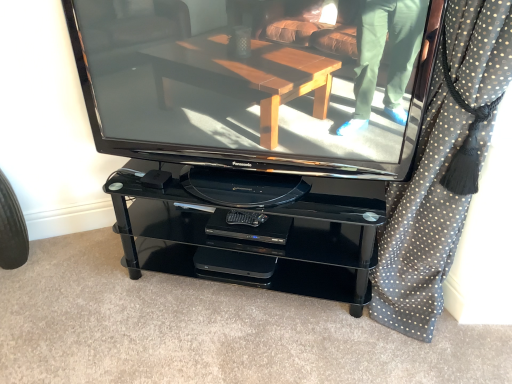
The width and height of the screenshot is (512, 384). What do you see at coordinates (12, 228) in the screenshot?
I see `black rubber tire at lower left` at bounding box center [12, 228].

Locate an element on the screen. Image resolution: width=512 pixels, height=384 pixels. matte black television at center is located at coordinates (245, 93).

From the image's perspective, is matte black television at center beneath black dotted fabric at right?

No, from the image's perspective, matte black television at center is not beneath black dotted fabric at right.

Between matte black television at center and black dotted fabric at right, which one appears on the right side from the viewer's perspective?

black dotted fabric at right.

Is there a large distance between matte black television at center and black dotted fabric at right?

No.

Does matte black television at center turn towards black dotted fabric at right?

No, matte black television at center is not aimed at black dotted fabric at right.

Is black rubber tire at lower left taller or shorter than matte black television at center?

black rubber tire at lower left is shorter than matte black television at center.

Is point (1, 216) positioned in front of point (383, 110)?

No, (1, 216) is further to viewer.

From the image's perspective, is black rubber tire at lower left over matte black television at center?

Incorrect, from the image's perspective, black rubber tire at lower left is lower than matte black television at center.

From a real-world perspective, is black rubber tire at lower left above or below matte black television at center?

black rubber tire at lower left is situated lower than matte black television at center in the real world.

Is black dotted fabric at right further to the viewer compared to black rubber tire at lower left?

No, it is not.

Consider the image. From a real-world perspective, is black dotted fabric at right positioned over black rubber tire at lower left based on gravity?

Yes.

Image resolution: width=512 pixels, height=384 pixels. Identify the location of tire located below the black dotted fabric at right (from the image's perspective). (12, 228).

Where is `television lying on the right of black rubber tire at lower left`? The width and height of the screenshot is (512, 384). television lying on the right of black rubber tire at lower left is located at coordinates (245, 93).

From a real-world perspective, between matte black television at center and black rubber tire at lower left, who is vertically lower?

black rubber tire at lower left, from a real-world perspective.

Does matte black television at center turn towards black rubber tire at lower left?

No, matte black television at center does not turn towards black rubber tire at lower left.

How far apart are matte black television at center and black rubber tire at lower left?

matte black television at center and black rubber tire at lower left are 1.01 meters apart.

Is black dotted fabric at right facing away from matte black television at center?

No, black dotted fabric at right is not facing away from matte black television at center.

Considering the relative sizes of black dotted fabric at right and matte black television at center in the image provided, is black dotted fabric at right shorter than matte black television at center?

No.

Which object is closer to the camera taking this photo, black dotted fabric at right or matte black television at center?

black dotted fabric at right is closer to the camera.

Is point (433, 303) positioned behind point (196, 109)?

Yes.

How different are the orientations of black rubber tire at lower left and black dotted fabric at right in degrees?

11 degrees separate the facing orientations of black rubber tire at lower left and black dotted fabric at right.

How distant is black rubber tire at lower left from black dotted fabric at right?

They are 5.41 feet apart.

From a real-world perspective, who is located higher, black rubber tire at lower left or black dotted fabric at right?

black dotted fabric at right.

Is black rubber tire at lower left shorter than black dotted fabric at right?

Yes, black rubber tire at lower left is shorter than black dotted fabric at right.

This screenshot has height=384, width=512. Identify the location of curtain on the right of matte black television at center. (422, 224).

At what (x,y) coordinates should I click in order to perform the action: click on tire lying below the matte black television at center (from the image's perspective). Please return your answer as a coordinate pair (x, y). Looking at the image, I should click on (x=12, y=228).

Estimate the real-world distances between objects in this image. Which object is closer to black rubber tire at lower left, matte black television at center or black dotted fabric at right?

matte black television at center lies closer to black rubber tire at lower left than the other object.

Looking at the image, which one is located closer to black dotted fabric at right, black rubber tire at lower left or matte black television at center?

Among the two, matte black television at center is located nearer to black dotted fabric at right.

Looking at the image, which one is located further to matte black television at center, black rubber tire at lower left or black dotted fabric at right?

black rubber tire at lower left is further to matte black television at center.

Looking at the image, which one is located further to black dotted fabric at right, matte black television at center or black rubber tire at lower left?

black rubber tire at lower left is further to black dotted fabric at right.

Based on their spatial positions, is black dotted fabric at right or matte black television at center further from black rubber tire at lower left?

The object further to black rubber tire at lower left is black dotted fabric at right.

When comparing their distances from matte black television at center, does black dotted fabric at right or black rubber tire at lower left seem closer?

Based on the image, black dotted fabric at right appears to be nearer to matte black television at center.

At what (x,y) coordinates should I click in order to perform the action: click on television located between black rubber tire at lower left and black dotted fabric at right in the left-right direction. Please return your answer as a coordinate pair (x, y). This screenshot has height=384, width=512. Looking at the image, I should click on (245, 93).